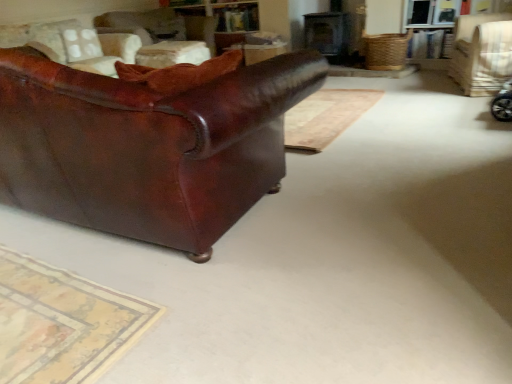
Question: From a real-world perspective, is shiny brown leather couch at left on top of leather couch at left, which appears as the first chair when viewed from the left?

Choices:
 (A) yes
 (B) no

Answer: (B)

Question: Could you tell me if shiny brown leather couch at left is turned towards leather couch at left, the 3th chair when ordered from right to left?

Choices:
 (A) yes
 (B) no

Answer: (B)

Question: From the image's perspective, is shiny brown leather couch at left below leather couch at left, which appears as the first chair when viewed from the left?

Choices:
 (A) yes
 (B) no

Answer: (A)

Question: From a real-world perspective, is shiny brown leather couch at left below leather couch at left, the 3th chair when ordered from right to left?

Choices:
 (A) yes
 (B) no

Answer: (A)

Question: Is shiny brown leather couch at left further to camera compared to leather couch at left, the 3th chair when ordered from right to left?

Choices:
 (A) no
 (B) yes

Answer: (A)

Question: Can leather couch at left, which appears as the first chair when viewed from the left, be found inside shiny brown leather couch at left?

Choices:
 (A) no
 (B) yes

Answer: (A)

Question: Is wooden table at center aimed at leather couch at left, which appears as the first chair when viewed from the left?

Choices:
 (A) no
 (B) yes

Answer: (A)

Question: From a real-world perspective, is wooden table at center positioned under leather couch at left, which appears as the first chair when viewed from the left, based on gravity?

Choices:
 (A) no
 (B) yes

Answer: (B)

Question: Considering the relative sizes of wooden table at center and leather couch at left, the 3th chair when ordered from right to left, in the image provided, is wooden table at center shorter than leather couch at left, the 3th chair when ordered from right to left,?

Choices:
 (A) no
 (B) yes

Answer: (B)

Question: Considering the relative sizes of wooden table at center and leather couch at left, the 3th chair when ordered from right to left, in the image provided, is wooden table at center smaller than leather couch at left, the 3th chair when ordered from right to left,?

Choices:
 (A) yes
 (B) no

Answer: (A)

Question: Could leather couch at left, which appears as the first chair when viewed from the left, be considered to be inside wooden table at center?

Choices:
 (A) no
 (B) yes

Answer: (A)

Question: From a real-world perspective, is wooden table at center on leather couch at left, which appears as the first chair when viewed from the left?

Choices:
 (A) no
 (B) yes

Answer: (A)

Question: Are leather couch at left, which appears as the first chair when viewed from the left, and shiny brown leather couch at left far apart?

Choices:
 (A) yes
 (B) no

Answer: (A)